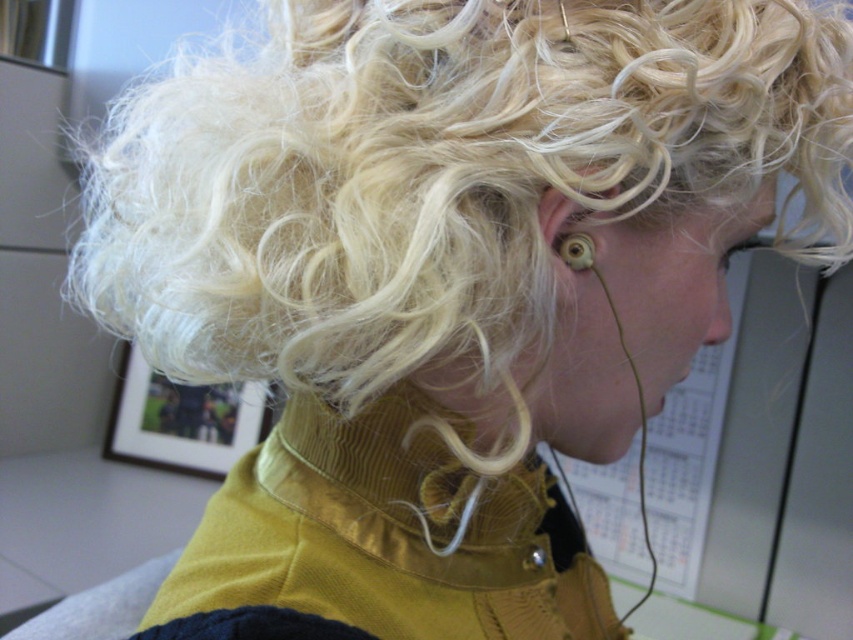
Who is higher up, yellow cord at center or gold metallic earring at ear?

gold metallic earring at ear is higher up.

Describe the element at coordinates (410, 468) in the screenshot. The image size is (853, 640). I see `yellow cord at center` at that location.

Identify the location of yellow cord at center. (410, 468).

Find the location of a particular element. This screenshot has height=640, width=853. yellow cord at center is located at coordinates (410, 468).